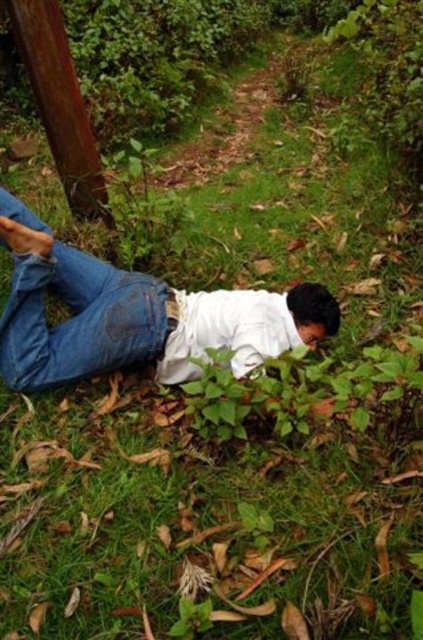
Measure the distance from denim at left to brushed wood telegraph pole at upper left.

denim at left and brushed wood telegraph pole at upper left are 31.00 inches apart from each other.

Is point (126, 364) closer to camera compared to point (57, 156)?

Yes, point (126, 364) is closer to viewer.

You are a GUI agent. You are given a task and a screenshot of the screen. Output one action in this format:
    pyautogui.click(x=<x>, y=<y>)
    Task: Click on the denim at left
    This screenshot has width=423, height=640.
    Given the screenshot: What is the action you would take?
    pyautogui.click(x=74, y=310)

Can you confirm if jeans at lower left is wider than brushed wood telegraph pole at upper left?

Yes, jeans at lower left is wider than brushed wood telegraph pole at upper left.

Which of these two, jeans at lower left or brushed wood telegraph pole at upper left, stands taller?

brushed wood telegraph pole at upper left

The width and height of the screenshot is (423, 640). What do you see at coordinates (134, 314) in the screenshot?
I see `jeans at lower left` at bounding box center [134, 314].

The image size is (423, 640). Find the location of `jeans at lower left`. jeans at lower left is located at coordinates (134, 314).

Who is higher up, jeans at lower left or denim at left?

Positioned higher is denim at left.

Is point (183, 362) closer to viewer compared to point (47, 230)?

No.

Does point (19, 324) lie behind point (47, 337)?

No.

Locate an element on the screen. jeans at lower left is located at coordinates tap(134, 314).